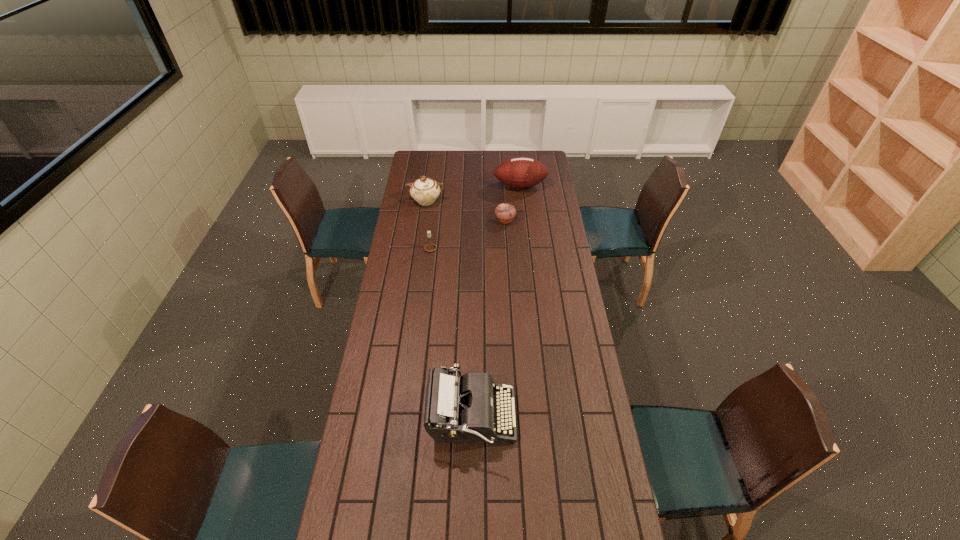
Locate an element on the screen. The width and height of the screenshot is (960, 540). blank space located on the side of the candle holder with the handle is located at coordinates (434, 219).

Find the location of a particular element. This screenshot has width=960, height=540. blank space located on the side of the candle holder with the handle is located at coordinates (436, 206).

At what (x,y) coordinates should I click in order to perform the action: click on free space located 0.150m on the side of the candle holder with the handle. Please return your answer as a coordinate pair (x, y). This screenshot has height=540, width=960. Looking at the image, I should click on (434, 223).

This screenshot has height=540, width=960. I want to click on vacant space located 0.340m on the left of the muffin, so click(428, 220).

Where is `chinaware situated at the left edge`? chinaware situated at the left edge is located at coordinates (425, 191).

Identify the location of candle holder at the left edge. (430, 247).

Locate an element on the screen. Image resolution: width=960 pixels, height=540 pixels. object present at the right edge is located at coordinates (519, 172).

Identify the location of free space at the far edge. (458, 162).

The height and width of the screenshot is (540, 960). Find the location of `blank space at the left edge of the desktop`. blank space at the left edge of the desktop is located at coordinates (358, 440).

Identify the location of vacant space at the right edge of the desktop. This screenshot has width=960, height=540. (597, 478).